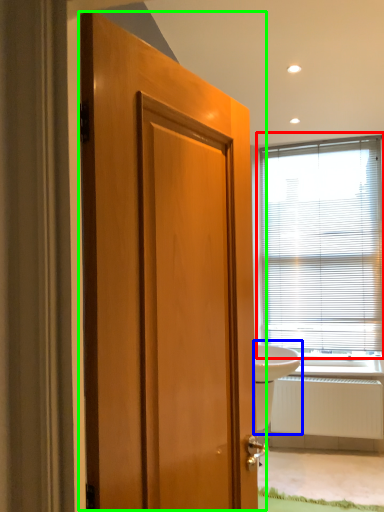
Question: Which is nearer to the window blind (highlighted by a red box)? sink (highlighted by a blue box) or door (highlighted by a green box).

Choices:
 (A) sink
 (B) door

Answer: (A)